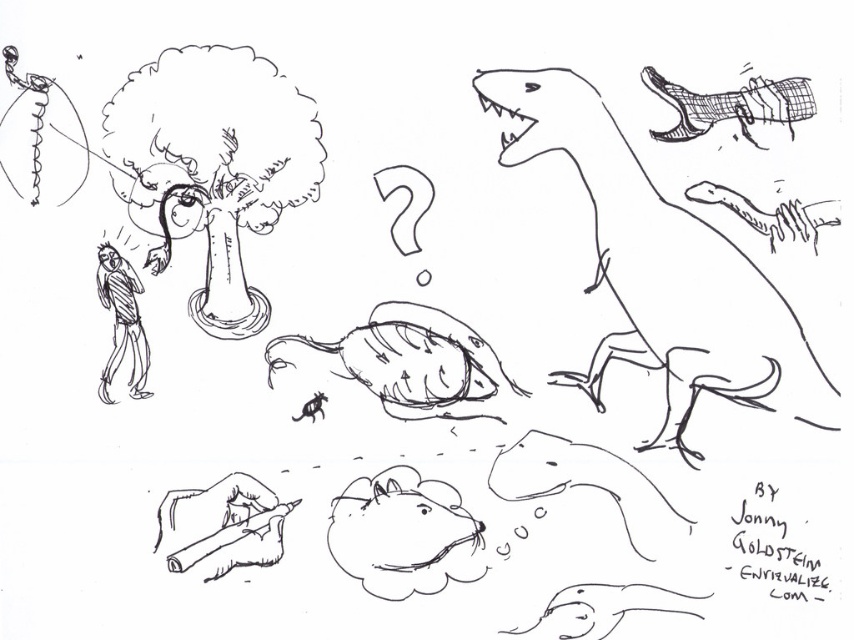
Question: Is smooth gray dinosaur at right to the right of grid-patterned dinosaur foot at upper right from the viewer's perspective?

Choices:
 (A) yes
 (B) no

Answer: (B)

Question: Estimate the real-world distances between objects in this image. Which object is closer to the fluffy white cloud at upper left?

Choices:
 (A) smooth wooden pencil at lower left
 (B) smooth gray dinosaur at right
 (C) smooth gray dinosaur at lower center

Answer: (A)

Question: Does grid-patterned dinosaur foot at upper right appear on the left side of smooth white snake at lower right?

Choices:
 (A) yes
 (B) no

Answer: (B)

Question: Estimate the real-world distances between objects in this image. Which object is closer to the smooth gray dinosaur at right?

Choices:
 (A) smooth wooden pencil at lower left
 (B) smooth brown mouse at center
 (C) grid-patterned dinosaur foot at upper right

Answer: (C)

Question: Does smooth gray dinosaur at right have a lesser width compared to grid-patterned dinosaur foot at upper right?

Choices:
 (A) yes
 (B) no

Answer: (B)

Question: Among these points, which one is farthest from the camera?

Choices:
 (A) (740, 108)
 (B) (624, 589)
 (C) (765, 300)
 (D) (389, 584)

Answer: (D)